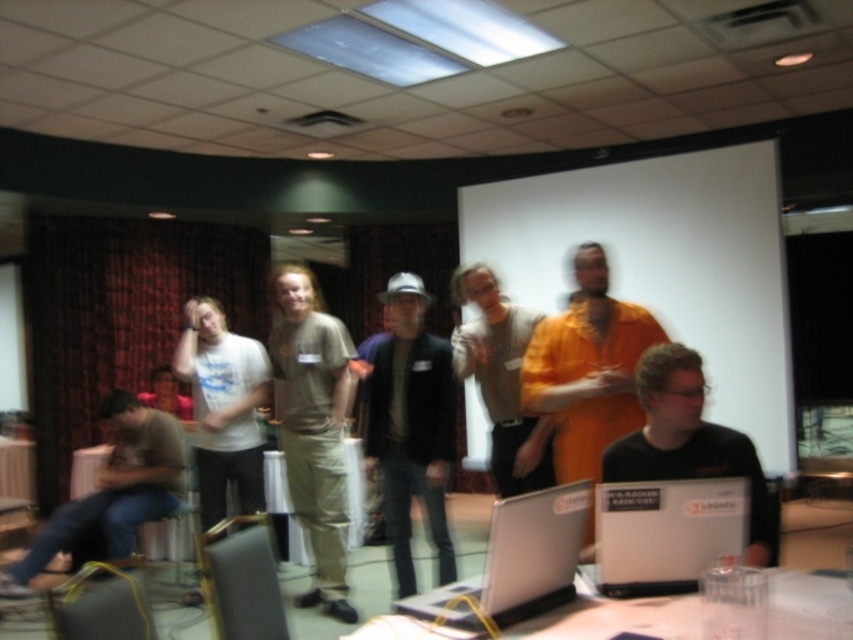
You are standing in the conference room and want to locate the black matte shirt at center. According to the coordinates provided, where should you look?

The black matte shirt at center is located at point (688, 440).

You are a photographer setting up equipment in the conference room. You need to position a tall tripod between the khaki cotton pants at center and the wooden table at lower left. Which object should the tripod be placed closer to to ensure it remains stable?

The tripod should be placed closer to the khaki cotton pants at center because it is much taller than the wooden table at lower left, providing a more stable base for the tripod.